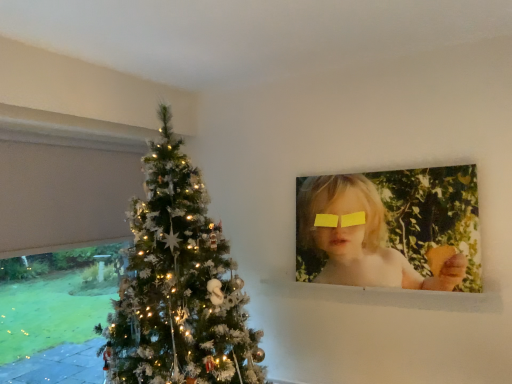
What do you see at coordinates (340, 220) in the screenshot?
I see `yellow matte glasses at upper center` at bounding box center [340, 220].

In order to click on yellow matte glasses at upper center in this screenshot , I will do `click(340, 220)`.

The height and width of the screenshot is (384, 512). What do you see at coordinates (359, 237) in the screenshot?
I see `matte yellow paper at upper right` at bounding box center [359, 237].

You are a GUI agent. You are given a task and a screenshot of the screen. Output one action in this format:
    pyautogui.click(x=<x>, y=<y>)
    Task: Click on the matte yellow paper at upper right
    The height and width of the screenshot is (384, 512).
    Given the screenshot: What is the action you would take?
    pyautogui.click(x=359, y=237)

In order to face matte yellow paper at upper right, should I rotate leftwards or rightwards?

A 15.887 degree turn to the right will do.

At what (x,y) coordinates should I click in order to perform the action: click on yellow matte glasses at upper center. Please return your answer as a coordinate pair (x, y). The image size is (512, 384). Looking at the image, I should click on (340, 220).

Consider the image. Between matte yellow paper at upper right and yellow matte glasses at upper center, which one appears on the left side from the viewer's perspective?

From the viewer's perspective, yellow matte glasses at upper center appears more on the left side.

Considering their positions, is matte yellow paper at upper right located in front of or behind yellow matte glasses at upper center?

Visually, matte yellow paper at upper right is located in front of yellow matte glasses at upper center.

Does point (397, 279) lie behind point (343, 217)?

No, it is in front of (343, 217).

Consider the image. From the image's perspective, relative to yellow matte glasses at upper center, is matte yellow paper at upper right above or below?

Clearly, from the image's perspective, matte yellow paper at upper right is below yellow matte glasses at upper center.

From a real-world perspective, which is physically below, matte yellow paper at upper right or yellow matte glasses at upper center?

In real-world perspective, matte yellow paper at upper right is lower.

Is matte yellow paper at upper right thinner than yellow matte glasses at upper center?

No.

Which of these two, matte yellow paper at upper right or yellow matte glasses at upper center, stands taller?

With more height is matte yellow paper at upper right.

Which of these two, matte yellow paper at upper right or yellow matte glasses at upper center, is bigger?

matte yellow paper at upper right is bigger.

Is yellow matte glasses at upper center located within matte yellow paper at upper right?

Absolutely, yellow matte glasses at upper center is inside matte yellow paper at upper right.

Is matte yellow paper at upper right not near yellow matte glasses at upper center?

That's not correct — matte yellow paper at upper right is a little close to yellow matte glasses at upper center.

Is matte yellow paper at upper right oriented towards yellow matte glasses at upper center?

Yes, matte yellow paper at upper right is facing yellow matte glasses at upper center.

Consider the image. Can you tell me how much matte yellow paper at upper right and yellow matte glasses at upper center differ in facing direction?

They differ by 0.0644 degrees in their facing directions.

The image size is (512, 384). I want to click on girl that is under the yellow matte glasses at upper center (from a real-world perspective), so 359,237.

Is yellow matte glasses at upper center to the left of matte yellow paper at upper right from the viewer's perspective?

Indeed, yellow matte glasses at upper center is positioned on the left side of matte yellow paper at upper right.

Which object is closer to the camera taking this photo, yellow matte glasses at upper center or matte yellow paper at upper right?

matte yellow paper at upper right is in front.

Does point (320, 218) come behind point (317, 259)?

Yes.

From the image's perspective, would you say yellow matte glasses at upper center is shown under matte yellow paper at upper right?

No, from the image's perspective, yellow matte glasses at upper center is not below matte yellow paper at upper right.

From a real-world perspective, is yellow matte glasses at upper center located higher than matte yellow paper at upper right?

Yes.

Considering the sizes of yellow matte glasses at upper center and matte yellow paper at upper right in the image, is yellow matte glasses at upper center wider or thinner than matte yellow paper at upper right?

Clearly, yellow matte glasses at upper center has less width compared to matte yellow paper at upper right.

Considering the relative sizes of yellow matte glasses at upper center and matte yellow paper at upper right in the image provided, is yellow matte glasses at upper center shorter than matte yellow paper at upper right?

Yes.

Which of these two, yellow matte glasses at upper center or matte yellow paper at upper right, is smaller?

With smaller size is yellow matte glasses at upper center.

Looking at this image, could matte yellow paper at upper right be considered to be inside yellow matte glasses at upper center?

Definitely not — matte yellow paper at upper right is not inside yellow matte glasses at upper center.

Is yellow matte glasses at upper center next to matte yellow paper at upper right?

No, yellow matte glasses at upper center is not beside matte yellow paper at upper right.

Is yellow matte glasses at upper center looking in the opposite direction of matte yellow paper at upper right?

Correct, yellow matte glasses at upper center is looking away from matte yellow paper at upper right.

How many degrees apart are the facing directions of yellow matte glasses at upper center and matte yellow paper at upper right?

They differ by 0.0644 degrees in their facing directions.

This screenshot has height=384, width=512. What are the coordinates of `glasses lying on the left of matte yellow paper at upper right` in the screenshot? It's located at (340, 220).

Identify the location of girl that appears in front of the yellow matte glasses at upper center. (359, 237).

Locate an element on the screen. The image size is (512, 384). girl below the yellow matte glasses at upper center (from the image's perspective) is located at coordinates [x=359, y=237].